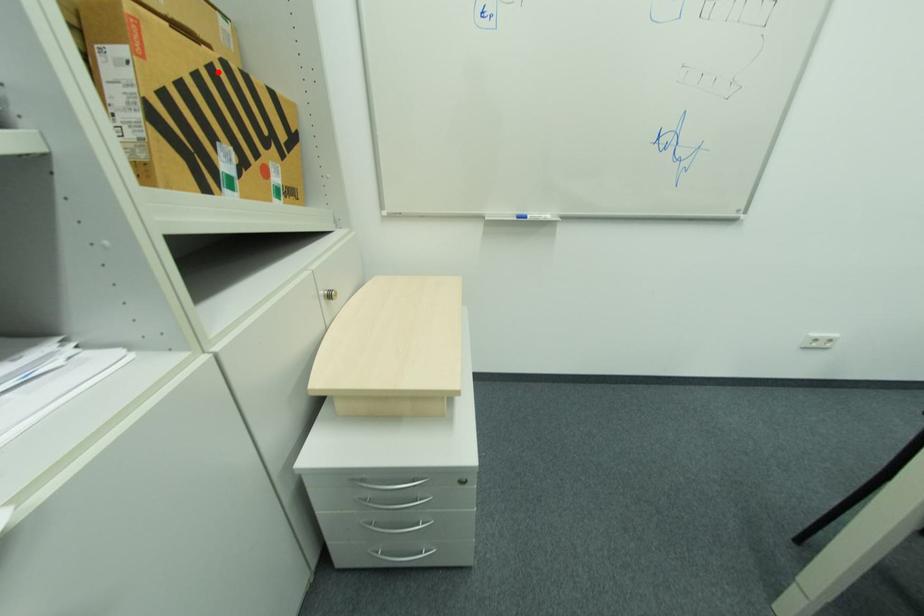
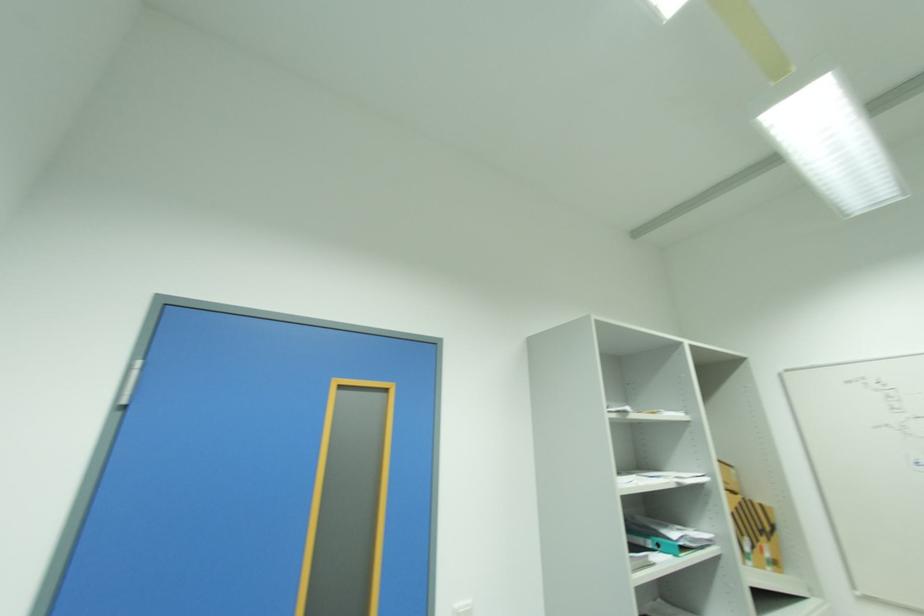
Locate, in the second image, the point that corresponds to the highlighted location in the first image.

(746, 506)